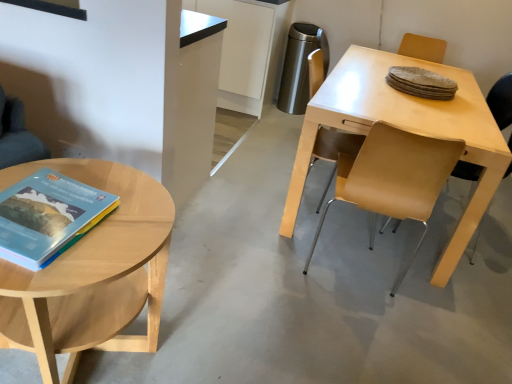
Question: In terms of width, does light brown wood coffee table at left look wider or thinner when compared to matte hardcover book at left?

Choices:
 (A) wide
 (B) thin

Answer: (A)

Question: Visually, is light brown wood coffee table at left positioned to the left or to the right of matte hardcover book at left?

Choices:
 (A) right
 (B) left

Answer: (B)

Question: Which object is the farthest from the matte hardcover book at left?

Choices:
 (A) light wood table at right
 (B) light brown wood coffee table at left
 (C) light brown leather chair at center, the first chair from the left
 (D) light brown leather chair at right, which appears as the first chair when viewed from the right

Answer: (D)

Question: Considering the real-world distances, which object is farthest from the light brown wood coffee table at left?

Choices:
 (A) light brown leather chair at right, which appears as the first chair when viewed from the right
 (B) light wood table at right
 (C) matte hardcover book at left
 (D) light brown leather chair at center, the first chair from the left

Answer: (A)